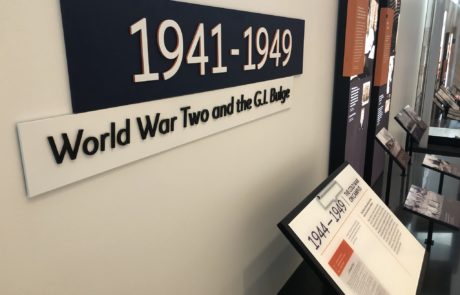
The height and width of the screenshot is (295, 460). Identify the location of square black base of pedestal, lower right corner. (430, 244).